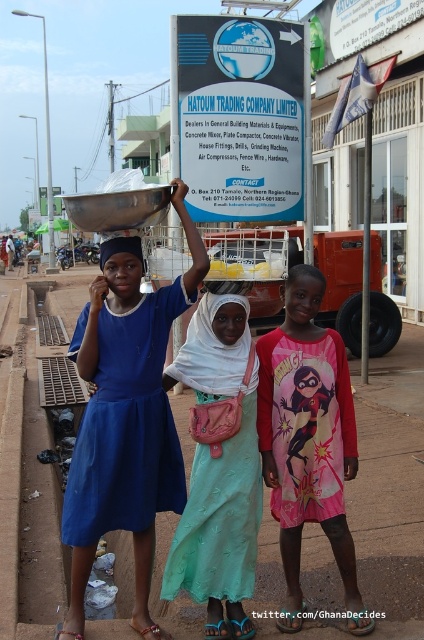
Consider the image. Is matte blue dress at left above matte blue headscarf at center?

No.

How far apart are matte blue dress at left and matte blue headscarf at center?

matte blue dress at left and matte blue headscarf at center are 28.44 inches apart from each other.

This screenshot has height=640, width=424. What do you see at coordinates (125, 417) in the screenshot?
I see `matte blue dress at left` at bounding box center [125, 417].

Locate an element on the screen. The width and height of the screenshot is (424, 640). matte blue dress at left is located at coordinates (125, 417).

Consider the image. Can you confirm if pink fabric purse at center is positioned to the right of matte blue headscarf at center?

Correct, you'll find pink fabric purse at center to the right of matte blue headscarf at center.

Which is in front, point (231, 499) or point (113, 244)?

Point (231, 499)

Who is more distant from viewer, (186,532) or (133,241)?

Positioned behind is point (133,241).

This screenshot has width=424, height=640. What are the coordinates of `pink fabric purse at center` in the screenshot? It's located at (219, 467).

Who is shorter, matte blue dress at left or pink cotton dress at center?

With less height is pink cotton dress at center.

Is point (181, 472) less distant than point (304, 445)?

That is False.

At what (x,y) coordinates should I click in order to perform the action: click on matte blue dress at left. Please return your answer as a coordinate pair (x, y). Looking at the image, I should click on (125, 417).